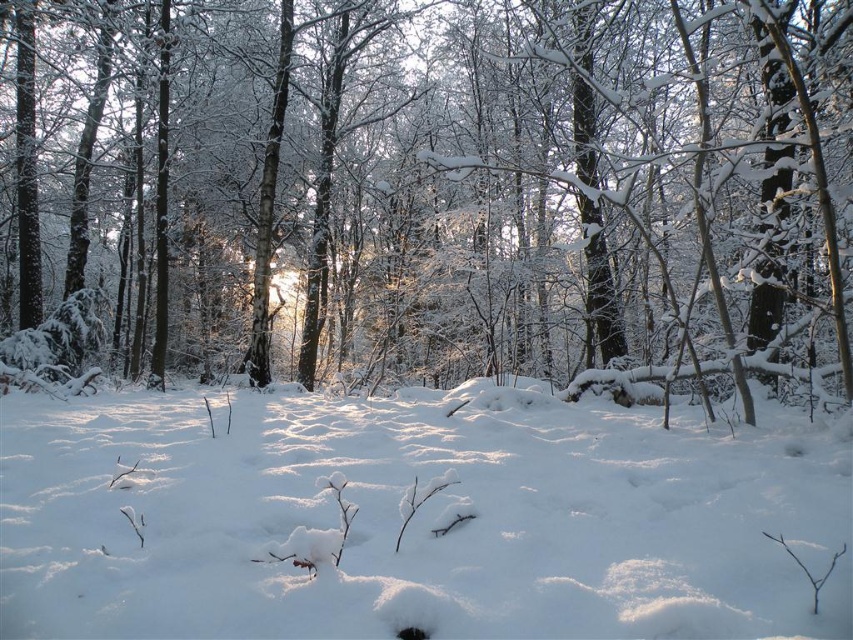
Does white snow-covered tree at center come in front of white fluffy snow at center?

No, it is behind white fluffy snow at center.

Can you confirm if white snow-covered tree at center is taller than white fluffy snow at center?

Yes, white snow-covered tree at center is taller than white fluffy snow at center.

What do you see at coordinates (428, 188) in the screenshot? The image size is (853, 640). I see `white snow-covered tree at center` at bounding box center [428, 188].

Find the location of a particular element. This screenshot has width=853, height=640. white snow-covered tree at center is located at coordinates (428, 188).